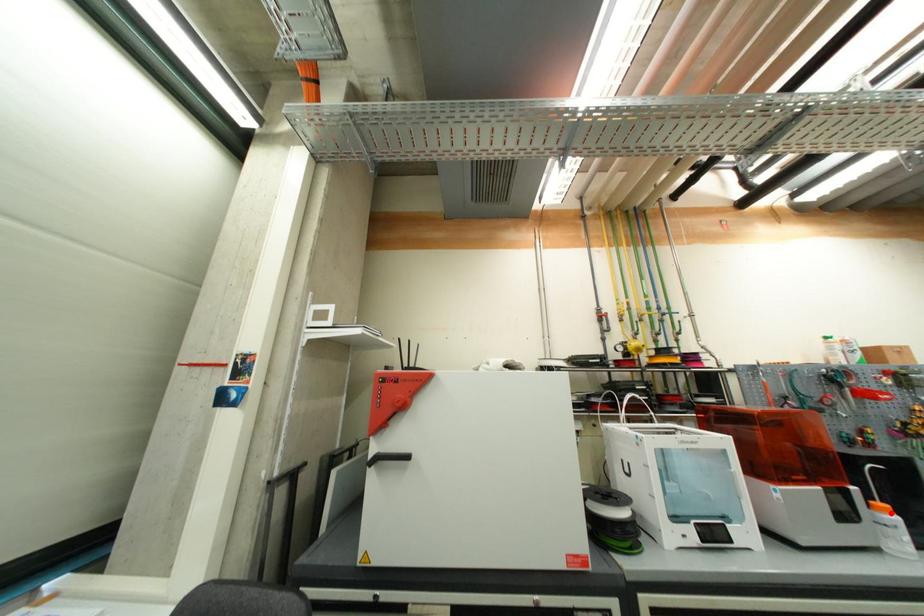
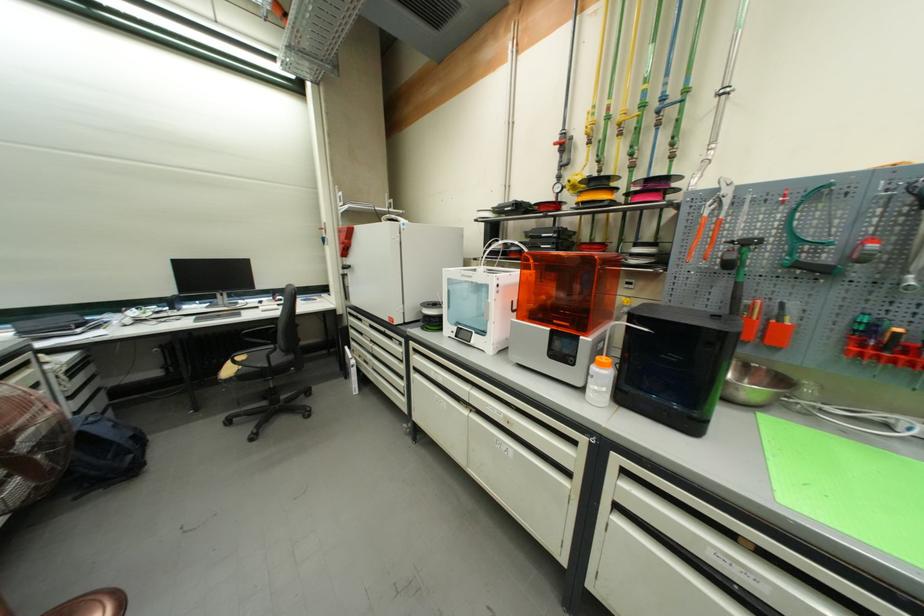
Where in the second image is the point corresponding to the highlighted location from the first image?

(606, 367)